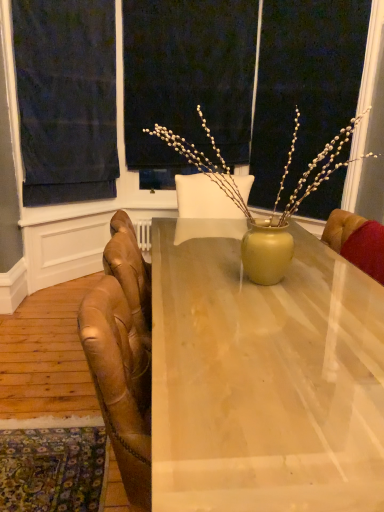
Question: Should I look upward or downward to see leather armchair at right?

Choices:
 (A) down
 (B) up

Answer: (A)

Question: Is matte wood desk at center looking in the opposite direction of matte black screen at upper center?

Choices:
 (A) no
 (B) yes

Answer: (A)

Question: Can you confirm if matte wood desk at center is shorter than matte black screen at upper center?

Choices:
 (A) no
 (B) yes

Answer: (B)

Question: From the image's perspective, is matte wood desk at center under matte black screen at upper center?

Choices:
 (A) no
 (B) yes

Answer: (B)

Question: Is matte wood desk at center at the left side of matte black screen at upper center?

Choices:
 (A) no
 (B) yes

Answer: (A)

Question: From a real-world perspective, is matte wood desk at center located beneath matte black screen at upper center?

Choices:
 (A) no
 (B) yes

Answer: (B)

Question: Is the position of matte wood desk at center more distant than that of matte black screen at upper center?

Choices:
 (A) yes
 (B) no

Answer: (B)

Question: Does dark blue fabric at upper left have a greater width compared to matte wood desk at center?

Choices:
 (A) yes
 (B) no

Answer: (B)

Question: From the image's perspective, would you say dark blue fabric at upper left is shown under matte wood desk at center?

Choices:
 (A) yes
 (B) no

Answer: (B)

Question: From the image's perspective, would you say dark blue fabric at upper left is positioned over matte wood desk at center?

Choices:
 (A) no
 (B) yes

Answer: (B)

Question: Does dark blue fabric at upper left lie behind matte wood desk at center?

Choices:
 (A) no
 (B) yes

Answer: (B)

Question: Can you confirm if dark blue fabric at upper left is shorter than matte wood desk at center?

Choices:
 (A) yes
 (B) no

Answer: (B)

Question: Can you confirm if dark blue fabric at upper left is thinner than matte wood desk at center?

Choices:
 (A) no
 (B) yes

Answer: (B)

Question: From the image's perspective, is dark blue fabric at upper left beneath leather armchair at right?

Choices:
 (A) no
 (B) yes

Answer: (A)